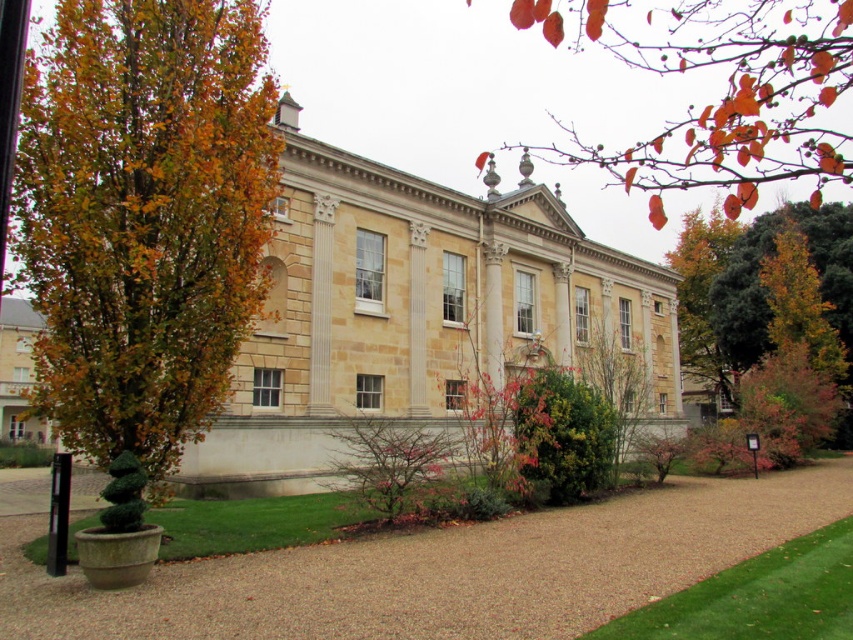
Can you confirm if gravel at center is shorter than orange leafy branch at upper right?

Yes.

Who is taller, gravel at center or orange leafy branch at upper right?

orange leafy branch at upper right is taller.

Find the location of a particular element. gravel at center is located at coordinates (440, 570).

Can you confirm if green leafy tree at center is positioned above pink textured bush at center?

Indeed, green leafy tree at center is positioned over pink textured bush at center.

This screenshot has width=853, height=640. In order to click on green leafy tree at center in this screenshot , I will do `click(766, 296)`.

Is point (18, 582) behind point (401, 422)?

No, (18, 582) is in front of (401, 422).

I want to click on gravel at center, so click(440, 570).

Locate an element on the screen. The height and width of the screenshot is (640, 853). gravel at center is located at coordinates (440, 570).